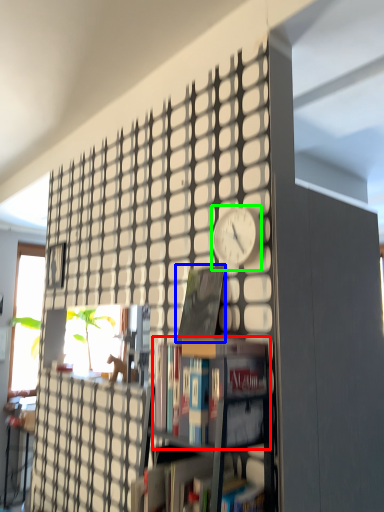
Question: Considering the real-world distances, which object is closest to book (highlighted by a red box)? book (highlighted by a blue box) or clock (highlighted by a green box).

Choices:
 (A) book
 (B) clock

Answer: (A)